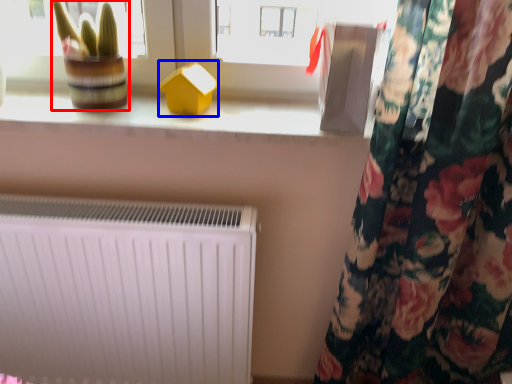
Question: Among these objects, which one is farthest to the camera, plant (highlighted by a red box) or toy (highlighted by a blue box)?

Choices:
 (A) plant
 (B) toy

Answer: (B)